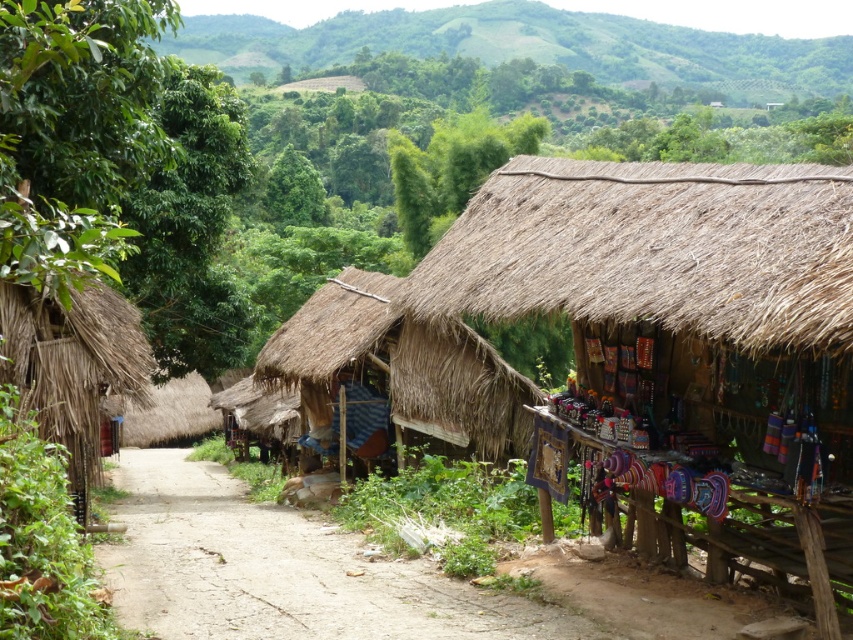
You are standing at the point with coordinates point (126, 355) in the village. You want to walk to the point with coordinates point (567, 36). Which direction should you move in to reach your destination?

To reach point (567, 36) from point (126, 355), you should move north because point (567, 36) is behind point (126, 355).

You are a traveler carrying a large backpack and need to find shelter for the night. You see the thatched straw hut at center and the thatched straw hut at left. Which one can accommodate your backpack more comfortably inside?

The thatched straw hut at left can accommodate your backpack more comfortably because its width is greater than the thatched straw hut at center.